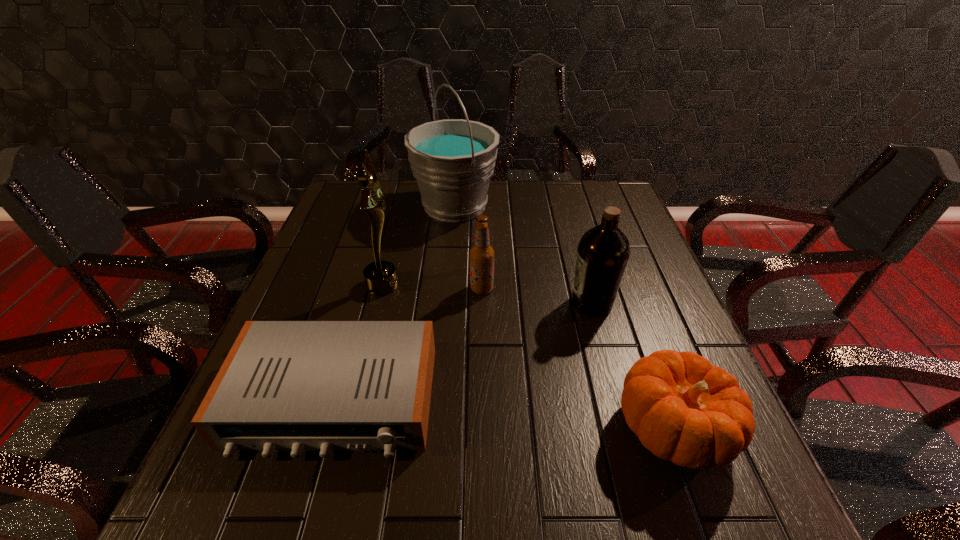
Where is `the farthest object`? the farthest object is located at coordinates (452, 160).

The width and height of the screenshot is (960, 540). Find the location of `award`. award is located at coordinates (381, 278).

You are a GUI agent. You are given a task and a screenshot of the screen. Output one action in this format:
    pyautogui.click(x=<x>, y=<y>)
    Task: Click on the olive oil
    This screenshot has width=960, height=540.
    Given the screenshot: What is the action you would take?
    pyautogui.click(x=603, y=252)

Locate an element on the screen. The width and height of the screenshot is (960, 540). the fourth tallest object is located at coordinates (481, 254).

Where is `the fifth tallest object`? The image size is (960, 540). the fifth tallest object is located at coordinates (684, 410).

Where is `the shortest object`? the shortest object is located at coordinates pyautogui.click(x=296, y=386).

Image resolution: width=960 pixels, height=540 pixels. In order to click on vacant region located on the front of the bucket in this screenshot , I will do `click(450, 260)`.

Locate an element on the screen. free space located on the front-facing side of the award is located at coordinates (538, 284).

This screenshot has height=540, width=960. Identify the location of free space located on the label of the olive oil. (523, 303).

The image size is (960, 540). In order to click on vacant area situated 0.050m on the label of the olive oil in this screenshot , I will do `click(548, 303)`.